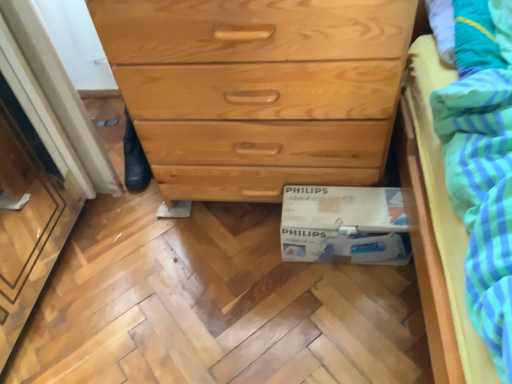
The height and width of the screenshot is (384, 512). I want to click on vacant area situated to the left side of white cardboard box at lower center, so 254,263.